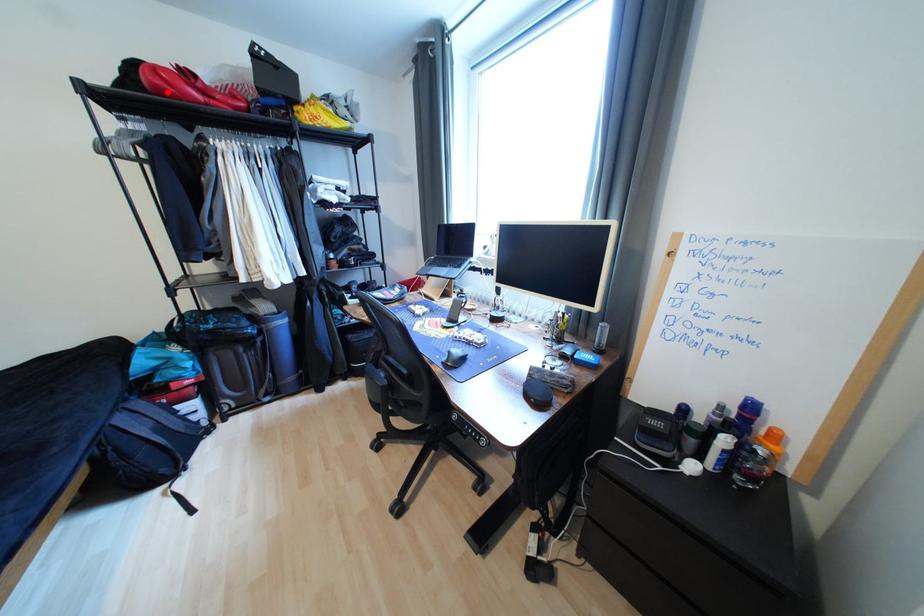
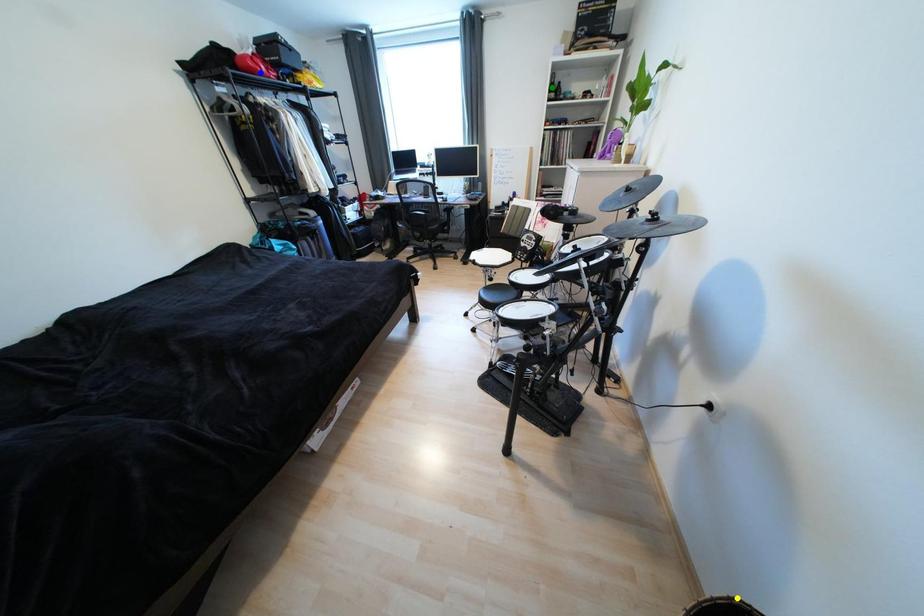
Question: I am providing you with two images of the same scene from different viewpoints. A red point is marked on the first image. You are given multiple points on the second image. In image 2, which mark is for the same physical point as the one in image 1?

Choices:
 (A) green point
 (B) blue point
 (C) yellow point

Answer: (B)